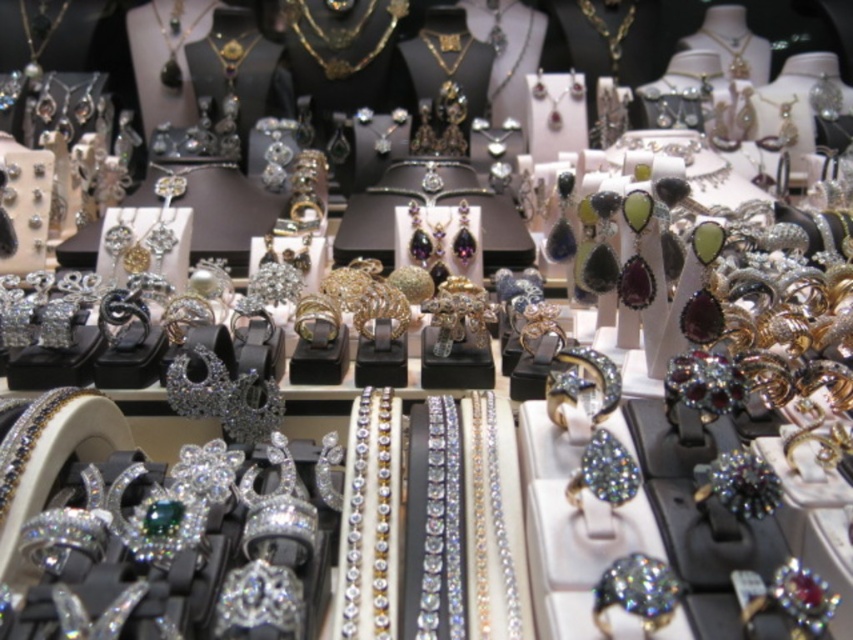
You are a customer at the jewelry store and see the matte black necklace at upper center and the gold shiny necklace at center. Which necklace is positioned to the left of the other?

The matte black necklace at upper center is to the left of the gold shiny necklace at center.

You are a customer at the jewelry store and want to pick up the item located at point (167, 26). However, there is an obstacle at point (440, 44) blocking your path. Can you reach the item without moving the obstacle?

Point (167, 26) is behind point (440, 44), so you cannot reach the item at point (167, 26) without moving the obstacle at point (440, 44).